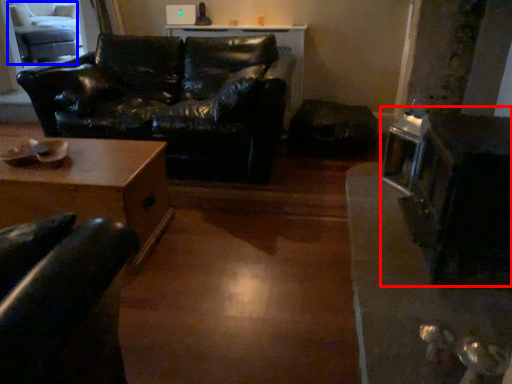
Question: Which object is closer to the camera taking this photo, appliance (highlighted by a red box) or swivel chair (highlighted by a blue box)?

Choices:
 (A) appliance
 (B) swivel chair

Answer: (A)